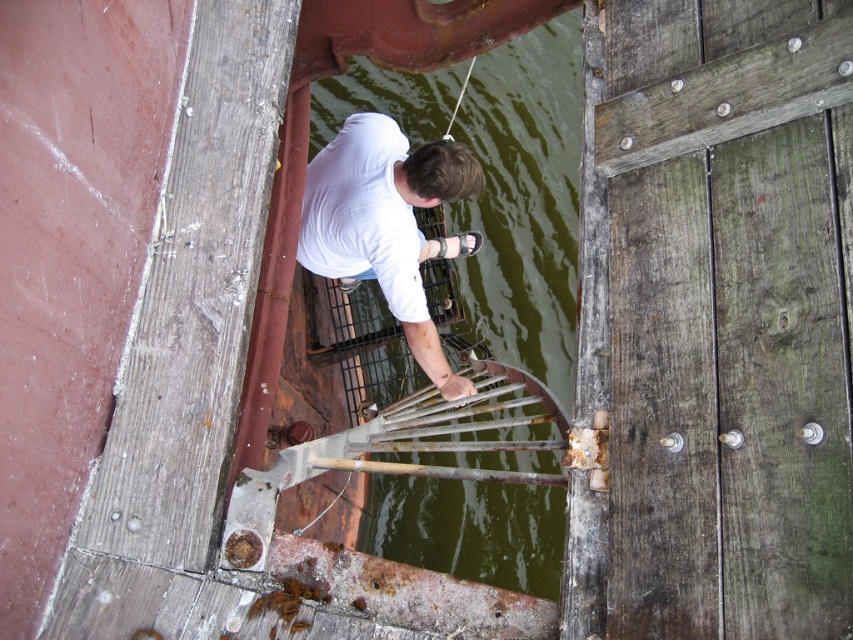
Question: Which object appears farthest from the camera in this image?

Choices:
 (A) white matte shirt at center
 (B) green murky water at center

Answer: (B)

Question: Does green murky water at center have a greater width compared to white matte shirt at center?

Choices:
 (A) yes
 (B) no

Answer: (A)

Question: Is green murky water at center closer to the viewer compared to white matte shirt at center?

Choices:
 (A) yes
 (B) no

Answer: (B)

Question: In this image, where is green murky water at center located relative to white matte shirt at center?

Choices:
 (A) below
 (B) above

Answer: (B)